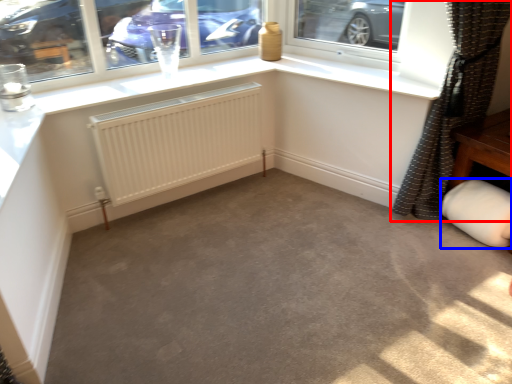
Question: Which object appears closest to the camera in this image, curtain (highlighted by a red box) or gray (highlighted by a blue box)?

Choices:
 (A) curtain
 (B) gray

Answer: (A)